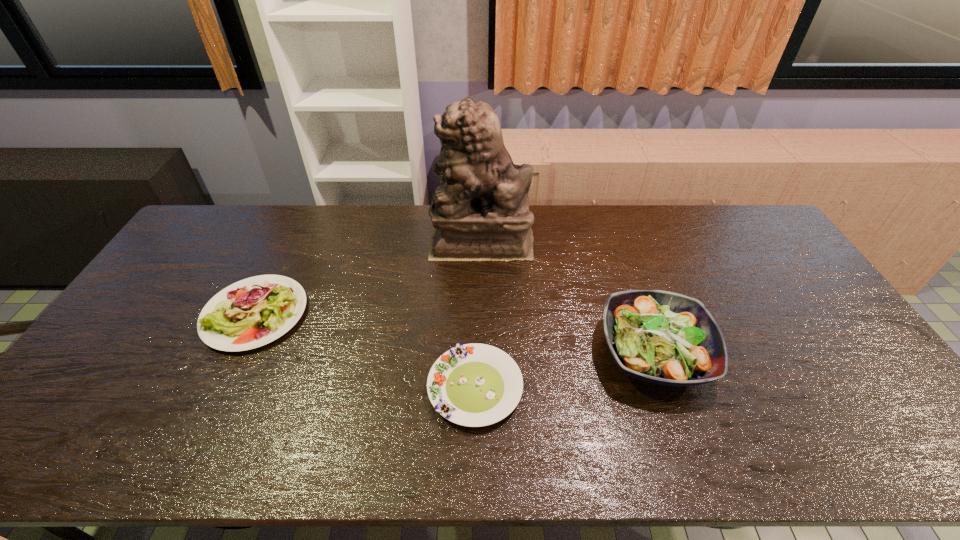
Identify the location of object that stands as the closest to the shortest object. The width and height of the screenshot is (960, 540). (660, 337).

Locate which object is the closest to the sculpture. Please provide its 2D coordinates. Your answer should be formatted as a tuple, i.e. [(x, y)], where the tuple contains the x and y coordinates of a point satisfying the conditions above.

[(660, 337)]

Where is `salad plate that stands as the closest to the farthest object`? The height and width of the screenshot is (540, 960). salad plate that stands as the closest to the farthest object is located at coordinates (660, 337).

Where is `salad plate that is the second closest to the rightmost salad plate`? salad plate that is the second closest to the rightmost salad plate is located at coordinates (255, 311).

Where is `free spot that satisfies the following two spatial constraints: 1. on the front-facing side of the rightmost object; 2. on the right side of the tallest object`? The height and width of the screenshot is (540, 960). free spot that satisfies the following two spatial constraints: 1. on the front-facing side of the rightmost object; 2. on the right side of the tallest object is located at coordinates (481, 353).

In order to click on free space that satisfies the following two spatial constraints: 1. on the front-facing side of the second tallest object; 2. on the left side of the sculpture in this screenshot , I will do `click(481, 353)`.

You are a GUI agent. You are given a task and a screenshot of the screen. Output one action in this format:
    pyautogui.click(x=<x>, y=<y>)
    Task: Click on the free region that satisfies the following two spatial constraints: 1. on the front-facing side of the sculpture; 2. on the front side of the second shortest object
    The height and width of the screenshot is (540, 960).
    Given the screenshot: What is the action you would take?
    pyautogui.click(x=481, y=314)

This screenshot has height=540, width=960. Identify the location of free location that satisfies the following two spatial constraints: 1. on the front-facing side of the farthest object; 2. on the right side of the rightmost salad plate. (481, 353).

This screenshot has width=960, height=540. Identify the location of free space that satisfies the following two spatial constraints: 1. on the front-facing side of the third shortest object; 2. on the right side of the tallest object. (481, 353).

Locate an element on the screen. The width and height of the screenshot is (960, 540). vacant area in the image that satisfies the following two spatial constraints: 1. on the front-facing side of the farthest object; 2. on the back side of the rightmost salad plate is located at coordinates (481, 353).